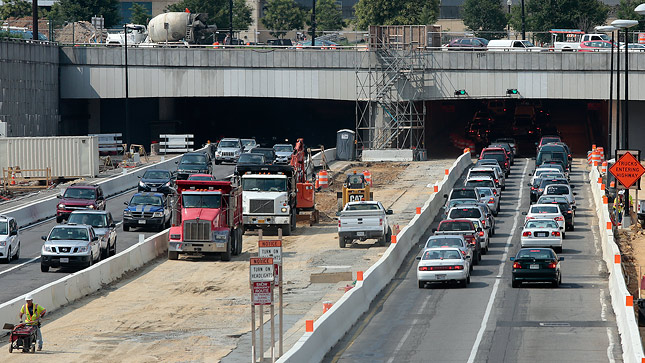
Find the location of a particular element. The height and width of the screenshot is (363, 645). green lights is located at coordinates (462, 92), (515, 91).